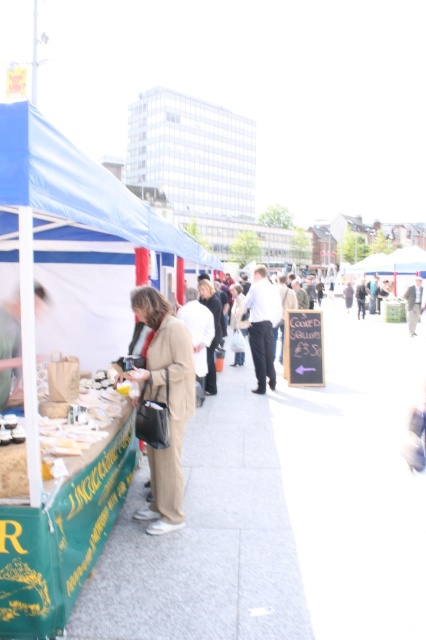
You are a delivery person who needs to place a package between the blue fabric canopy at left and the white fabric street vendor at center. The package requires 3 meters of space to be placed safely. Is there enough space between them?

The blue fabric canopy at left and white fabric street vendor at center are 3.69 meters apart, so yes, there is enough space between them to safely place the package since the distance exceeds the required 3 meters.

You are a customer at the market and want to know which of the two fabric structures, the blue fabric canopy at left or the white fabric street vendor at center, is bigger in size. Can you tell me which one is larger?

The blue fabric canopy at left has a larger size compared to the white fabric street vendor at center, so the blue fabric canopy at left is bigger.